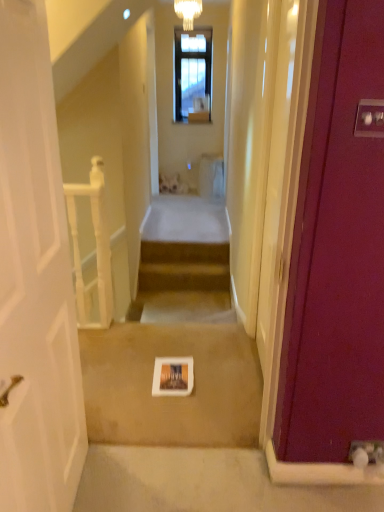
Image resolution: width=384 pixels, height=512 pixels. Describe the element at coordinates (188, 12) in the screenshot. I see `white glass chandelier at upper center` at that location.

Identify the location of white matte book at center. (171, 397).

Can you confirm if white wooden balustrade at left is taller than white glass chandelier at upper center?

Correct, white wooden balustrade at left is much taller as white glass chandelier at upper center.

Who is bigger, white wooden balustrade at left or white glass chandelier at upper center?

With larger size is white wooden balustrade at left.

Which is in front, point (89, 307) or point (194, 17)?

The point (89, 307) is closer to the camera.

Who is more distant, white wooden balustrade at left or white glass chandelier at upper center?

white glass chandelier at upper center is more distant.

Is white matte book at center facing towards white glass chandelier at upper center?

No, white matte book at center is not oriented towards white glass chandelier at upper center.

Who is taller, white matte book at center or white glass chandelier at upper center?

white glass chandelier at upper center.

From the image's perspective, would you say white matte book at center is shown under white glass chandelier at upper center?

Yes.

Is white matte book at center in contact with white glass chandelier at upper center?

No, white matte book at center is not making contact with white glass chandelier at upper center.

In the scene shown: Is white matte book at center far away from white wooden balustrade at left?

No, white matte book at center is in close proximity to white wooden balustrade at left.

Does point (191, 430) appear closer or farther from the camera than point (87, 317)?

Point (191, 430) is positioned closer to the camera compared to point (87, 317).

From a real-world perspective, is white matte book at center above or below white wooden balustrade at left?

white matte book at center is situated lower than white wooden balustrade at left in the real world.

Locate an element on the screen. The image size is (384, 512). balustrade above the white matte book at center (from a real-world perspective) is located at coordinates (96, 248).

Is white matte book at center completely or partially inside white wooden balustrade at left?

No.

Who is shorter, white wooden balustrade at left or white matte book at center?

white matte book at center.

Are white wooden balustrade at left and white matte book at center far apart?

They are positioned close to each other.

Is white glass chandelier at upper center located outside white matte book at center?

Yes, white glass chandelier at upper center is located beyond the bounds of white matte book at center.

Is white glass chandelier at upper center taller or shorter than white matte book at center?

In the image, white glass chandelier at upper center appears to be taller than white matte book at center.

Relative to white matte book at center, is white glass chandelier at upper center in front or behind?

In the image, white glass chandelier at upper center appears behind white matte book at center.

Consider the image. Is white matte book at center at the back of white glass chandelier at upper center?

No, white glass chandelier at upper center's orientation is not away from white matte book at center.

From the picture: Is white glass chandelier at upper center at the right side of white wooden balustrade at left?

Correct, you'll find white glass chandelier at upper center to the right of white wooden balustrade at left.

Does white glass chandelier at upper center have a lesser width compared to white wooden balustrade at left?

Yes.

Could you tell me if white glass chandelier at upper center is turned towards white wooden balustrade at left?

No.

Identify the location of light fixture that appears on the right of white wooden balustrade at left. (188, 12).

Where is `light fixture located above the white matte book at center (from the image's perspective)`? light fixture located above the white matte book at center (from the image's perspective) is located at coordinates (188, 12).

In the scene shown: Estimate the real-world distances between objects in this image. Which object is further from white wooden balustrade at left, white glass chandelier at upper center or white matte book at center?

The object further to white wooden balustrade at left is white glass chandelier at upper center.

In the scene shown: Which object lies further to the anchor point white matte book at center, white wooden balustrade at left or white glass chandelier at upper center?

The object further to white matte book at center is white glass chandelier at upper center.

From the image, which object appears to be nearer to white wooden balustrade at left, white matte book at center or white glass chandelier at upper center?

white matte book at center lies closer to white wooden balustrade at left than the other object.

Consider the image. Considering their positions, is white glass chandelier at upper center positioned closer to white matte book at center than white wooden balustrade at left?

Among the two, white wooden balustrade at left is located nearer to white matte book at center.

Which object lies further to the anchor point white glass chandelier at upper center, white wooden balustrade at left or white matte book at center?

white matte book at center is positioned further to the anchor white glass chandelier at upper center.

From the image, which object appears to be farther from white glass chandelier at upper center, white matte book at center or white wooden balustrade at left?

Based on the image, white matte book at center appears to be further to white glass chandelier at upper center.

I want to click on balustrade between white glass chandelier at upper center and white matte book at center in the vertical direction, so click(x=96, y=248).